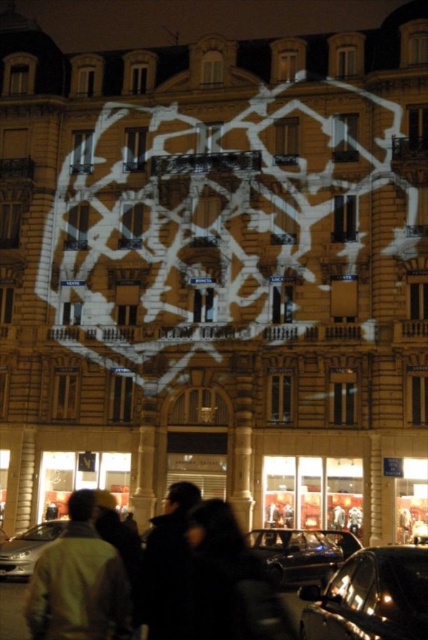
You are standing in front of the building and notice both the light brown leather jacket at lower left and the shiny black car at lower right. Which object appears taller from your perspective?

The light brown leather jacket at lower left appears taller than the shiny black car at lower right.

You are standing in front of the building and notice two points on its facade. The first point is at coordinates point [397,609] and the second is at point [299,572]. Which point is closer to you?

Point [397,609] is in front of point [299,572], so it is closer to you.

Where is the light brown leather jacket at lower left located in terms of coordinates?

The light brown leather jacket at lower left is located at coordinates point (79,580).